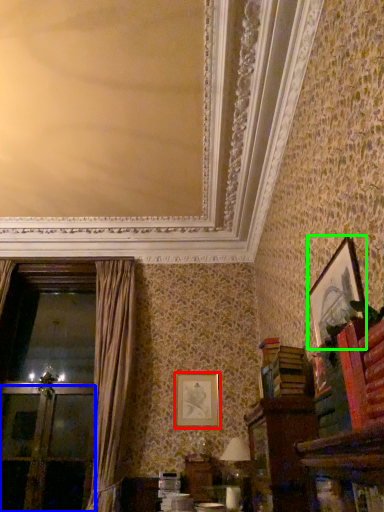
Question: Estimate the real-world distances between objects in this image. Which object is farther from picture frame (highlighted by a red box), screen door (highlighted by a blue box) or picture frame (highlighted by a green box)?

Choices:
 (A) screen door
 (B) picture frame

Answer: (B)